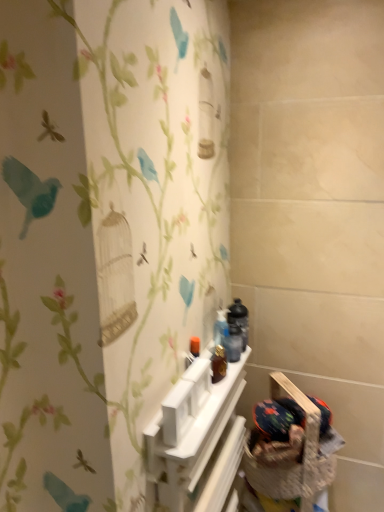
I want to click on free spot above fluffy fabric basket at lower right (from a real-world perspective), so click(285, 418).